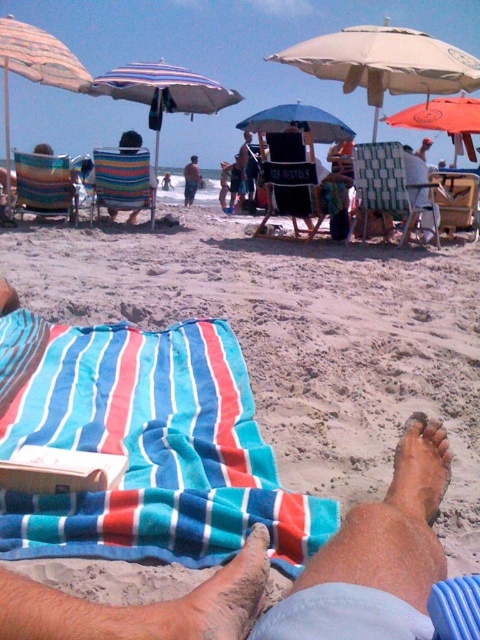
In the scene shown: You are a beachgoer who wants to set up your striped fabric beach chair at center under the shade of the beige fabric umbrella at upper left. Can you place the chair directly underneath the umbrella without needing to adjust the umbrella or chair positions?

The beige fabric umbrella at upper left is much taller than the striped fabric beach chair at center, so yes, you can place the striped fabric beach chair at center directly underneath the beige fabric umbrella at upper left without needing to adjust their positions.

You are standing at the beach and want to find a spot under an umbrella. You see the beige fabric umbrella at upper left and the orange fabric umbrella at upper right. Which umbrella is positioned higher above the other?

The beige fabric umbrella at upper left is located above the orange fabric umbrella at upper right.

You are planning to set up a new umbrella between the beige fabric umbrella at upper left and the orange fabric umbrella at upper right. Based on their sizes, which side should you place it to avoid blocking the sunlight of the smaller one?

The beige fabric umbrella at upper left might be wider than orange fabric umbrella at upper right, so place the new umbrella on the side of the orange fabric umbrella at upper right to avoid blocking the smaller one.